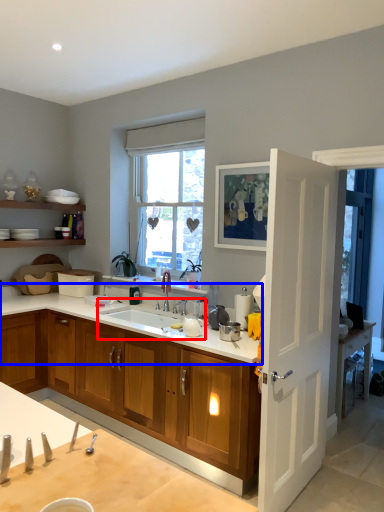
Question: Among these objects, which one is farthest to the camera, sink (highlighted by a red box) or countertop (highlighted by a blue box)?

Choices:
 (A) sink
 (B) countertop

Answer: (A)